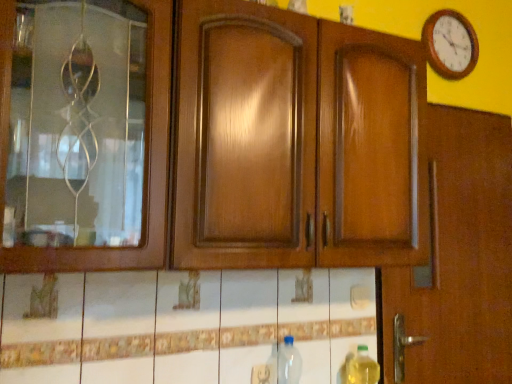
Question: Does yellow translucent bottle at lower right, which is the second bottle from left to right, have a lesser width compared to wooden clock at upper right?

Choices:
 (A) no
 (B) yes

Answer: (A)

Question: Is yellow translucent bottle at lower right, arranged as the first bottle when viewed from the right, in contact with wooden clock at upper right?

Choices:
 (A) yes
 (B) no

Answer: (B)

Question: From a real-world perspective, is yellow translucent bottle at lower right, arranged as the first bottle when viewed from the right, over wooden clock at upper right?

Choices:
 (A) yes
 (B) no

Answer: (B)

Question: Does yellow translucent bottle at lower right, which is the second bottle from left to right, have a smaller size compared to wooden clock at upper right?

Choices:
 (A) yes
 (B) no

Answer: (A)

Question: Does yellow translucent bottle at lower right, which is the second bottle from left to right, come in front of wooden clock at upper right?

Choices:
 (A) no
 (B) yes

Answer: (B)

Question: From a real-world perspective, is yellow translucent bottle at lower right, arranged as the first bottle when viewed from the right, beneath wooden clock at upper right?

Choices:
 (A) no
 (B) yes

Answer: (B)

Question: Would you consider transparent plastic bottle at lower center, arranged as the first bottle when viewed from the left, to be distant from wooden clock at upper right?

Choices:
 (A) no
 (B) yes

Answer: (B)

Question: Is transparent plastic bottle at lower center, which is counted as the 2th bottle, starting from the right, oriented towards wooden clock at upper right?

Choices:
 (A) yes
 (B) no

Answer: (B)

Question: From the image's perspective, is transparent plastic bottle at lower center, which is counted as the 2th bottle, starting from the right, below wooden clock at upper right?

Choices:
 (A) yes
 (B) no

Answer: (A)

Question: Does transparent plastic bottle at lower center, which is counted as the 2th bottle, starting from the right, have a larger size compared to wooden clock at upper right?

Choices:
 (A) no
 (B) yes

Answer: (A)

Question: Can you confirm if transparent plastic bottle at lower center, which is counted as the 2th bottle, starting from the right, is shorter than wooden clock at upper right?

Choices:
 (A) no
 (B) yes

Answer: (A)

Question: Considering the relative positions of transparent plastic bottle at lower center, which is counted as the 2th bottle, starting from the right, and wooden clock at upper right in the image provided, is transparent plastic bottle at lower center, which is counted as the 2th bottle, starting from the right, in front of wooden clock at upper right?

Choices:
 (A) yes
 (B) no

Answer: (A)

Question: Is wooden clock at upper right further to the viewer compared to yellow translucent bottle at lower right, arranged as the first bottle when viewed from the right?

Choices:
 (A) yes
 (B) no

Answer: (A)